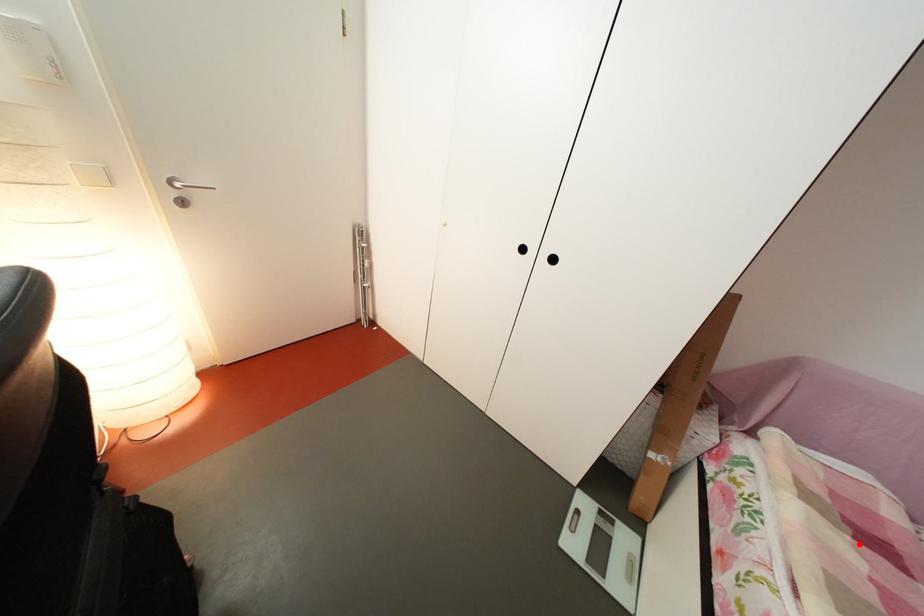
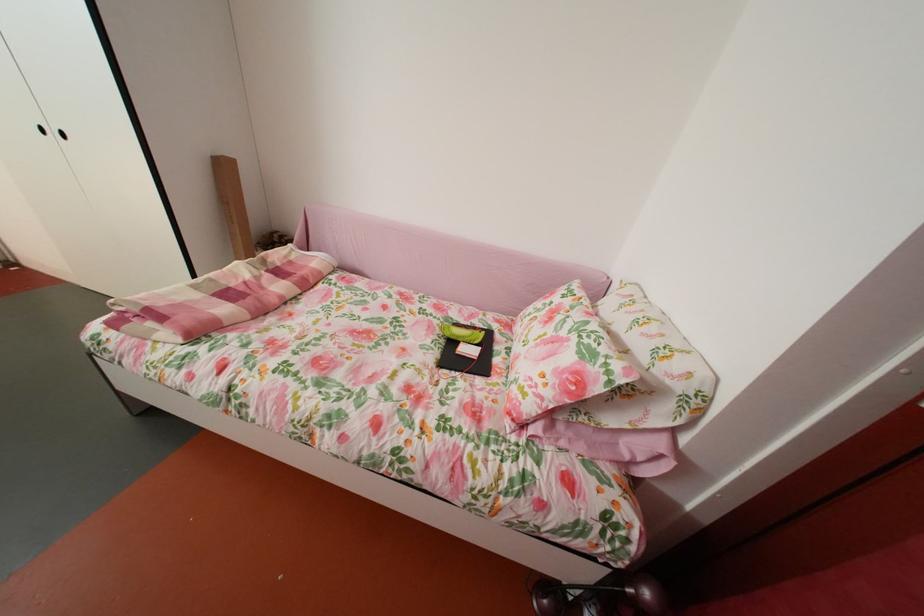
Locate, in the second image, the point that corresponds to the highlighted location in the first image.

(274, 278)